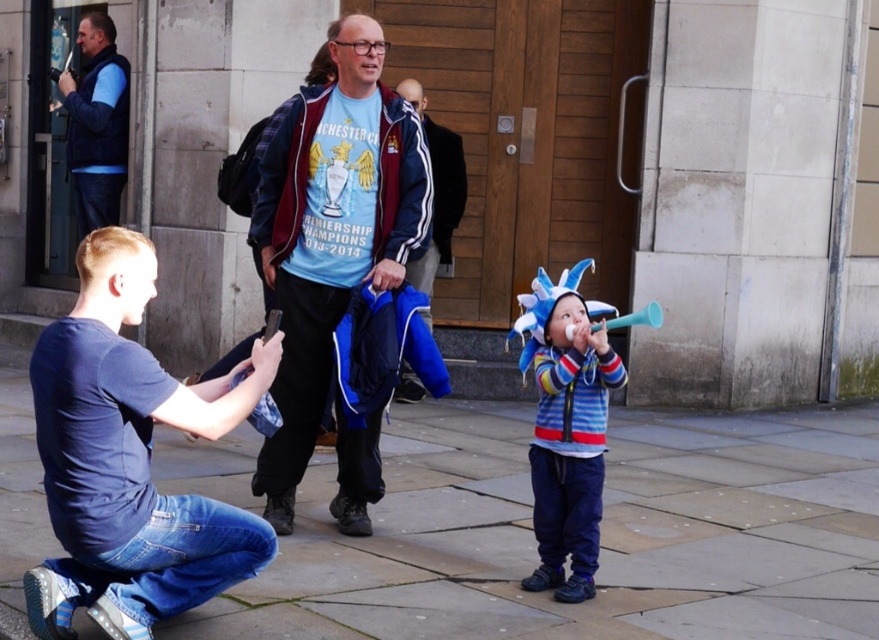
Can you confirm if slate gray paving stone at center is wider than blue fleece vest at left?

Indeed, slate gray paving stone at center has a greater width compared to blue fleece vest at left.

Looking at this image, between slate gray paving stone at center and blue fleece vest at left, which one is positioned higher?

Positioned higher is blue fleece vest at left.

This screenshot has width=879, height=640. Identify the location of slate gray paving stone at center. (600, 540).

Does blue fleece vest at left have a greater height compared to blue fleece jacket at center?

Yes, blue fleece vest at left is taller than blue fleece jacket at center.

Between blue fleece vest at left and blue fleece jacket at center, which one has less height?

blue fleece jacket at center is shorter.

What do you see at coordinates (96, 124) in the screenshot? I see `blue fleece vest at left` at bounding box center [96, 124].

Where is `blue fleece vest at left`? This screenshot has width=879, height=640. blue fleece vest at left is located at coordinates (96, 124).

Who is lower down, blue fabric jacket at center or blue fleece jacket at center?

blue fabric jacket at center

Who is more forward, [333,266] or [447,131]?

Point [333,266] is in front.

Does point (259, 454) come farther from viewer compared to point (441, 216)?

No.

Image resolution: width=879 pixels, height=640 pixels. Identify the location of blue fabric jacket at center. (332, 232).